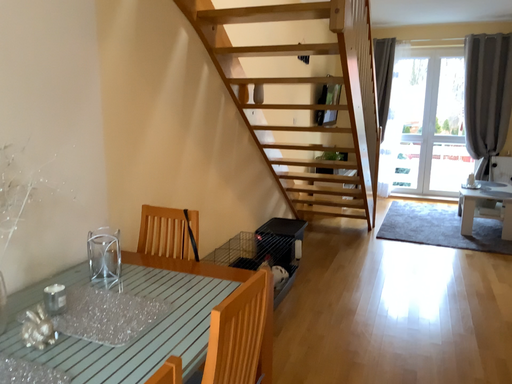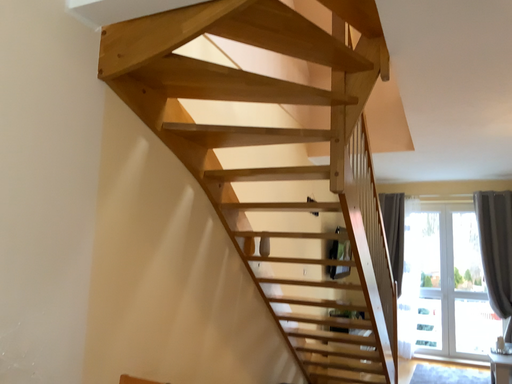
Question: How did the camera likely rotate when shooting the video?

Choices:
 (A) rotated upward
 (B) rotated downward

Answer: (A)